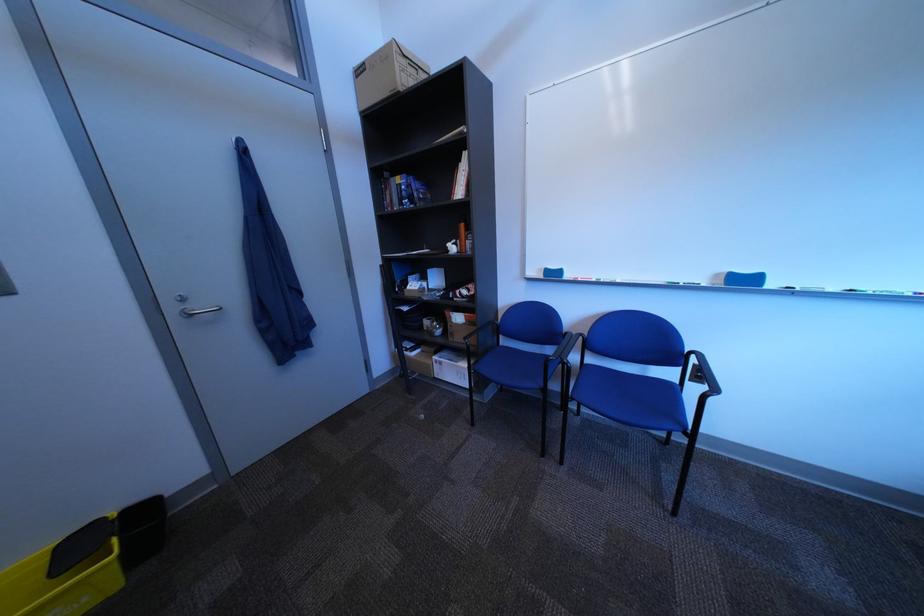
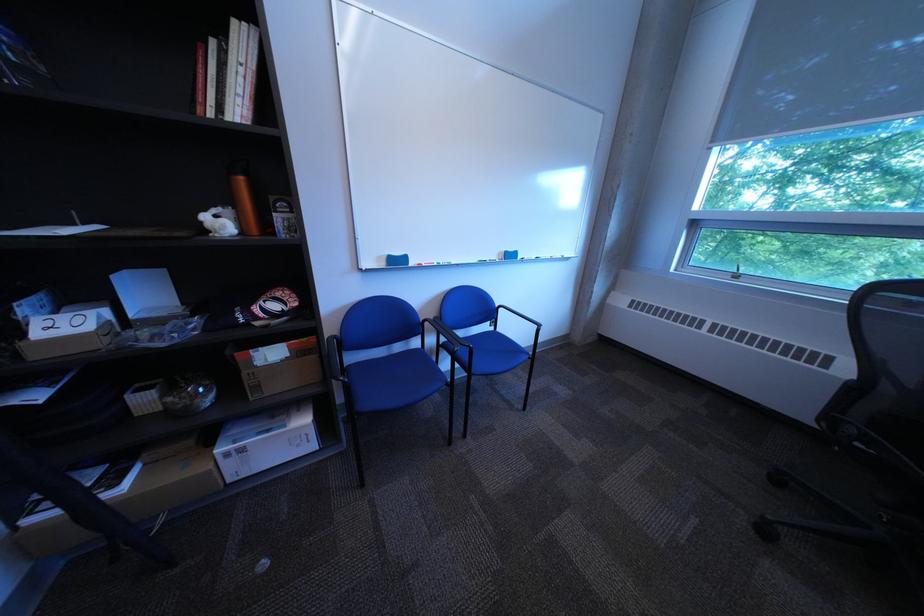
Question: The camera is either moving clockwise (left) or counter-clockwise (right) around the object. The first image is from the beginning of the video and the second image is from the end. Is the camera moving left or right when shooting the video?

Choices:
 (A) Left
 (B) Right

Answer: (A)